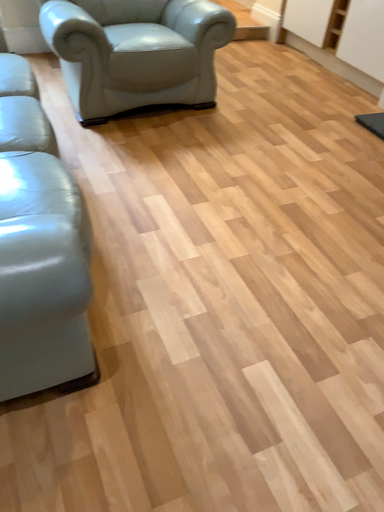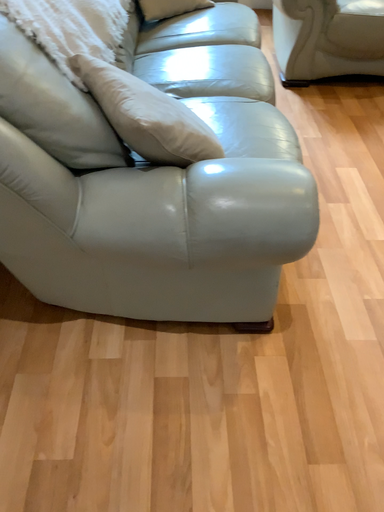
Question: Which way did the camera rotate in the video?

Choices:
 (A) rotated left
 (B) rotated right

Answer: (A)